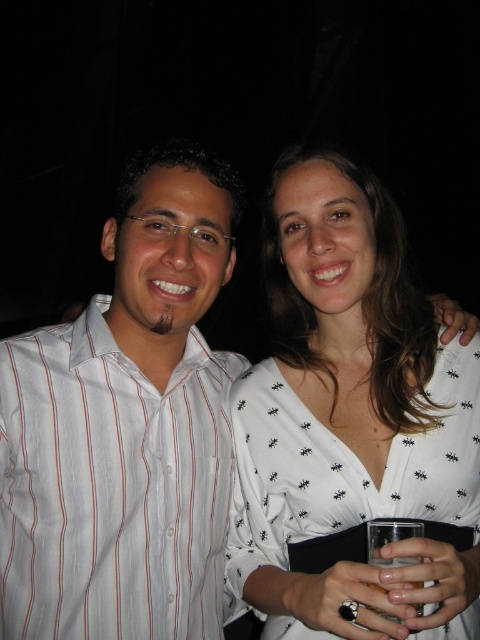
Question: Which is nearer to the clear glass at lower center?

Choices:
 (A) white striped shirt at left
 (B) white printed dress at center

Answer: (B)

Question: Does white striped shirt at left have a larger size compared to white printed dress at center?

Choices:
 (A) yes
 (B) no

Answer: (B)

Question: Which object is farther from the camera taking this photo?

Choices:
 (A) white printed dress at center
 (B) white striped shirt at left

Answer: (B)

Question: Is white striped shirt at left smaller than clear glass at lower center?

Choices:
 (A) yes
 (B) no

Answer: (B)

Question: Based on their relative distances, which object is nearer to the white printed dress at center?

Choices:
 (A) white striped shirt at left
 (B) clear glass at lower center

Answer: (A)

Question: Is white striped shirt at left positioned at the back of white printed dress at center?

Choices:
 (A) yes
 (B) no

Answer: (A)